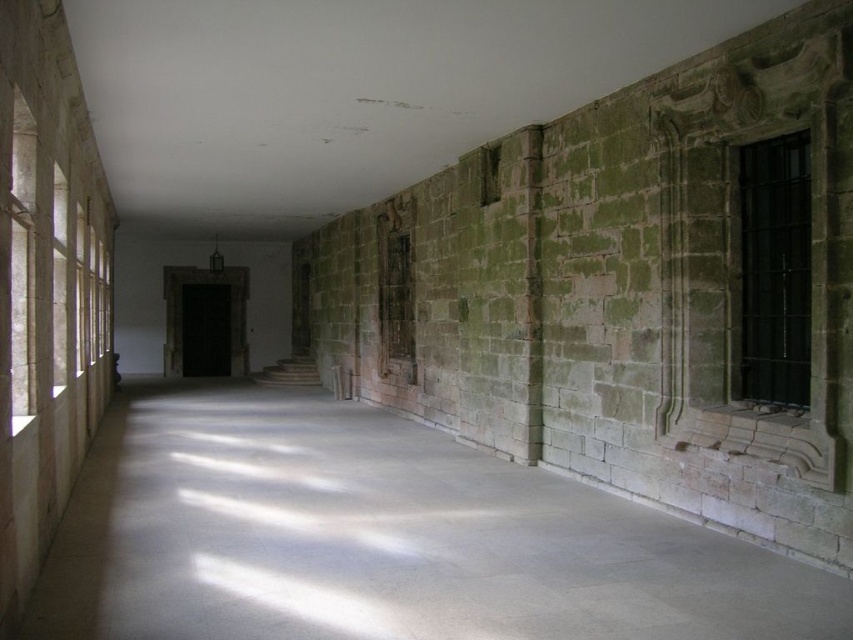
Can you confirm if smooth concrete floor at center is positioned to the left of black metal window at right?

Indeed, smooth concrete floor at center is positioned on the left side of black metal window at right.

Which is in front, point (454, 616) or point (782, 232)?

Point (454, 616) is in front.

Identify the location of smooth concrete floor at center. This screenshot has height=640, width=853. (380, 538).